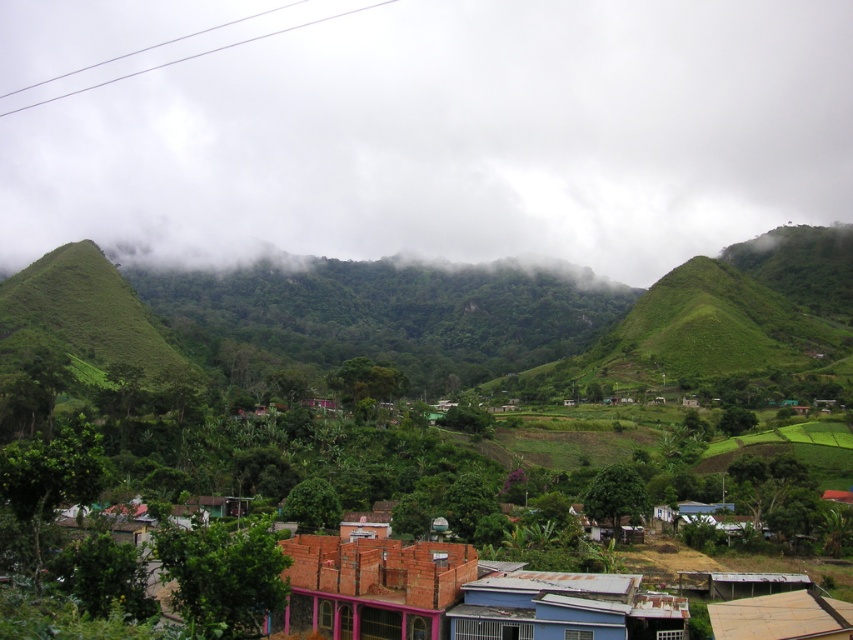
In the scene shown: Is brick house at center shorter than brown wooden hut at lower right?

Incorrect, brick house at center's height does not fall short of brown wooden hut at lower right's.

Does brick house at center lie behind brown wooden hut at lower right?

No, brick house at center is closer to the viewer.

Is point (308, 593) closer to viewer compared to point (730, 605)?

No, it is behind (730, 605).

Identify the location of brick house at center. (372, 586).

Is point (248, 99) positioned after point (751, 609)?

Yes, it is behind point (751, 609).

Can you confirm if green leafy hillside at upper center is positioned above brown wooden hut at lower right?

Indeed, green leafy hillside at upper center is positioned over brown wooden hut at lower right.

What do you see at coordinates (447, 136) in the screenshot?
I see `green leafy hillside at upper center` at bounding box center [447, 136].

Locate an element on the screen. Image resolution: width=853 pixels, height=640 pixels. green leafy hillside at upper center is located at coordinates (447, 136).

Does point (102, 273) come farther from viewer compared to point (735, 598)?

Yes, point (102, 273) is farther from viewer.

Between green leafy hillside at left and brown wooden hut at lower right, which one has more height?

Standing taller between the two is green leafy hillside at left.

Who is more distant from viewer, [91,312] or [781,612]?

Point [91,312]

You are a GUI agent. You are given a task and a screenshot of the screen. Output one action in this format:
    pyautogui.click(x=<x>, y=<y>)
    Task: Click on the green leafy hillside at left
    
    Given the screenshot: What is the action you would take?
    pyautogui.click(x=82, y=317)